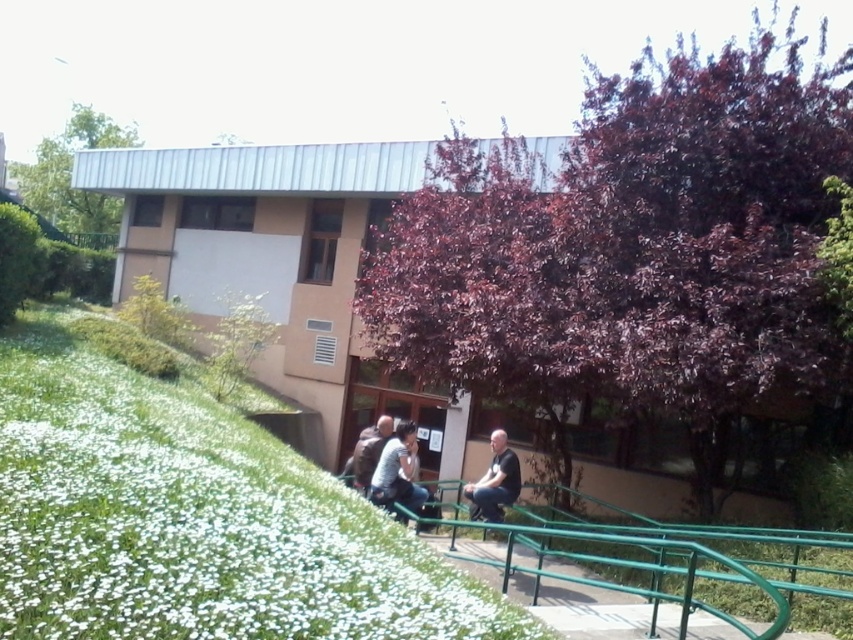
You are standing on the grassy area at the bottom of the stairs and want to walk towards the purple leafy tree at center. Which direction should you walk to avoid stepping on the white soft grass at lower left?

To reach the purple leafy tree at center without stepping on the white soft grass at lower left, you should walk towards the right side of the purple leafy tree at center. Since the white soft grass at lower left is behind the purple leafy tree at center, moving around to its right would allow you to bypass the grass area.

You are standing at the base of the hill and want to take a photo of both the point at coordinates point (605,125) and the point at coordinates point (370,444). Which point will appear larger in your photo?

Point (605,125) is closer to the camera than point (370,444), so it will appear larger in the photo.

You are standing at the base of the purple leafy tree at center and want to reach the brown leather jacket at center. Which direction should you walk to get closer to the jacket?

The brown leather jacket at center is taller than the purple leafy tree at center, so you should walk towards the direction where the jacket is located to get closer.